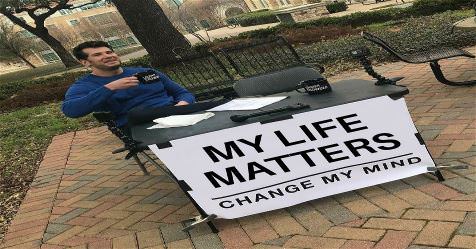
The width and height of the screenshot is (476, 249). What are the coordinates of `black folding table` in the screenshot? It's located at 347,96.